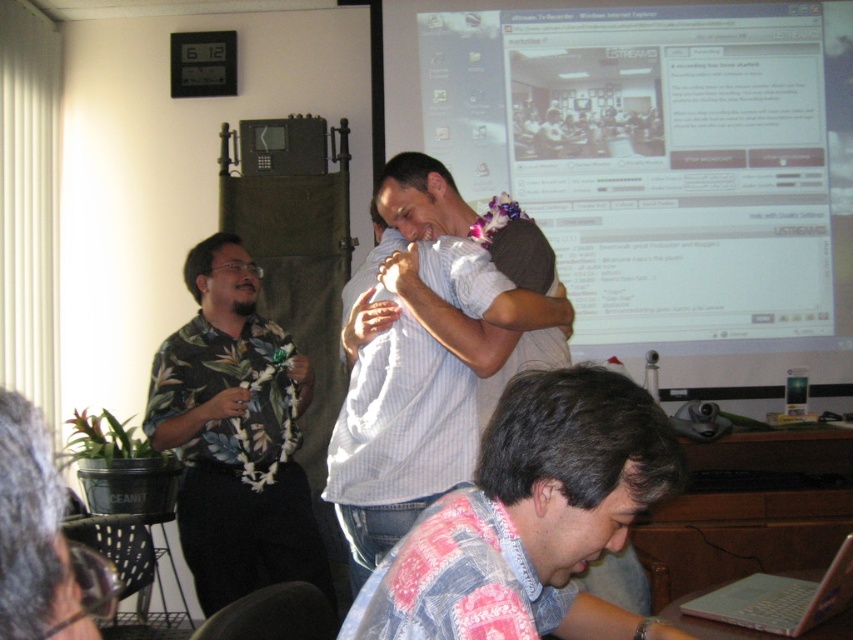
Is printed fabric shirt at center further to the viewer compared to white shirt at center?

No, printed fabric shirt at center is in front of white shirt at center.

Can you confirm if printed fabric shirt at center is wider than white shirt at center?

Correct, the width of printed fabric shirt at center exceeds that of white shirt at center.

This screenshot has width=853, height=640. Find the location of `printed fabric shirt at center`. printed fabric shirt at center is located at coordinates (531, 518).

You are a GUI agent. You are given a task and a screenshot of the screen. Output one action in this format:
    pyautogui.click(x=<x>, y=<y>)
    Task: Click on the printed fabric shirt at center
    The height and width of the screenshot is (640, 853).
    Given the screenshot: What is the action you would take?
    pyautogui.click(x=531, y=518)

Can you confirm if white glossy projection screen at upper center is smaller than white striped shirt at center?

No, white glossy projection screen at upper center is not smaller than white striped shirt at center.

Does white glossy projection screen at upper center appear on the right side of white striped shirt at center?

Yes, white glossy projection screen at upper center is to the right of white striped shirt at center.

Locate an element on the screen. white glossy projection screen at upper center is located at coordinates (656, 168).

You are a GUI agent. You are given a task and a screenshot of the screen. Output one action in this format:
    pyautogui.click(x=<x>, y=<y>)
    Task: Click on the white glossy projection screen at upper center
    
    Given the screenshot: What is the action you would take?
    pyautogui.click(x=656, y=168)

Which is more to the left, green leafy shirt at left or white striped shirt at center?

Positioned to the left is green leafy shirt at left.

Can you confirm if green leafy shirt at left is thinner than white striped shirt at center?

In fact, green leafy shirt at left might be wider than white striped shirt at center.

The height and width of the screenshot is (640, 853). What do you see at coordinates (235, 435) in the screenshot?
I see `green leafy shirt at left` at bounding box center [235, 435].

This screenshot has height=640, width=853. What are the coordinates of `green leafy shirt at left` in the screenshot? It's located at (235, 435).